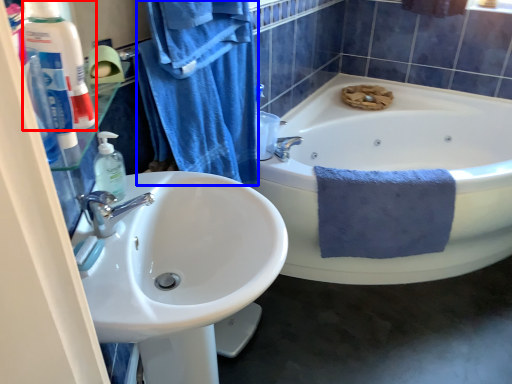
Question: Which point is further to the camera, toiletry (highlighted by a red box) or bath towel (highlighted by a blue box)?

Choices:
 (A) toiletry
 (B) bath towel

Answer: (B)